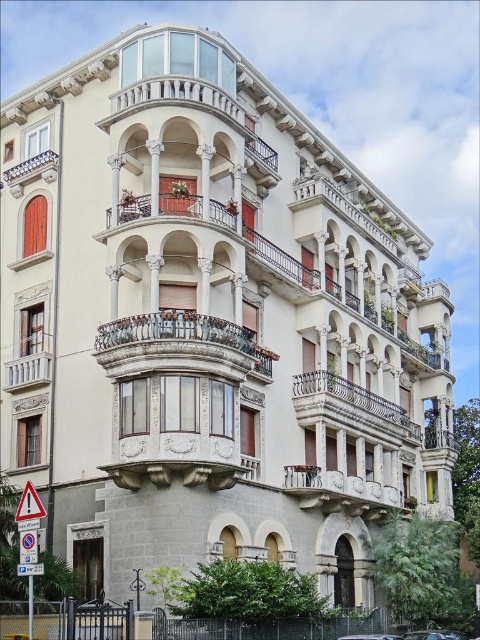
Question: In this image, where is rustic wrought iron balcony at center located relative to white stone balcony at center?

Choices:
 (A) right
 (B) left

Answer: (B)

Question: Which of the following is the farthest from the observer?

Choices:
 (A) yellow plastic triangle at lower left
 (B) shiny silver car at lower right
 (C) rustic wrought iron balcony at center
 (D) rustic wood balcony at center

Answer: (B)

Question: Does yellow plastic triangle at lower left have a larger size compared to shiny silver car at lower right?

Choices:
 (A) yes
 (B) no

Answer: (B)

Question: Which is nearer to the white stone balcony at center?

Choices:
 (A) metallic silver car at lower center
 (B) shiny silver car at lower right

Answer: (A)

Question: Is polished bronze railing at center positioned at the back of shiny silver car at lower right?

Choices:
 (A) yes
 (B) no

Answer: (A)

Question: Which point is closer to the camera?

Choices:
 (A) polished metal balcony at upper left
 (B) shiny silver car at lower right
 (C) metallic silver car at lower center
 (D) rustic wrought iron balcony at center

Answer: (D)